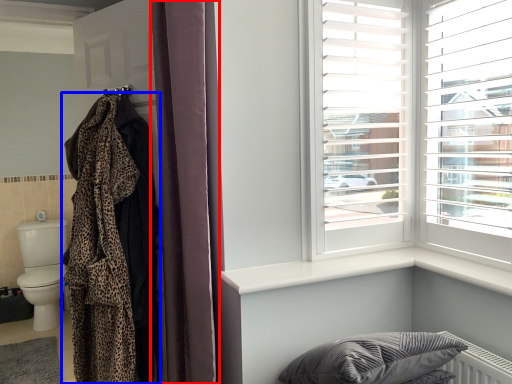
Question: Which object is further to the camera taking this photo, curtain (highlighted by a red box) or blanket (highlighted by a blue box)?

Choices:
 (A) curtain
 (B) blanket

Answer: (B)